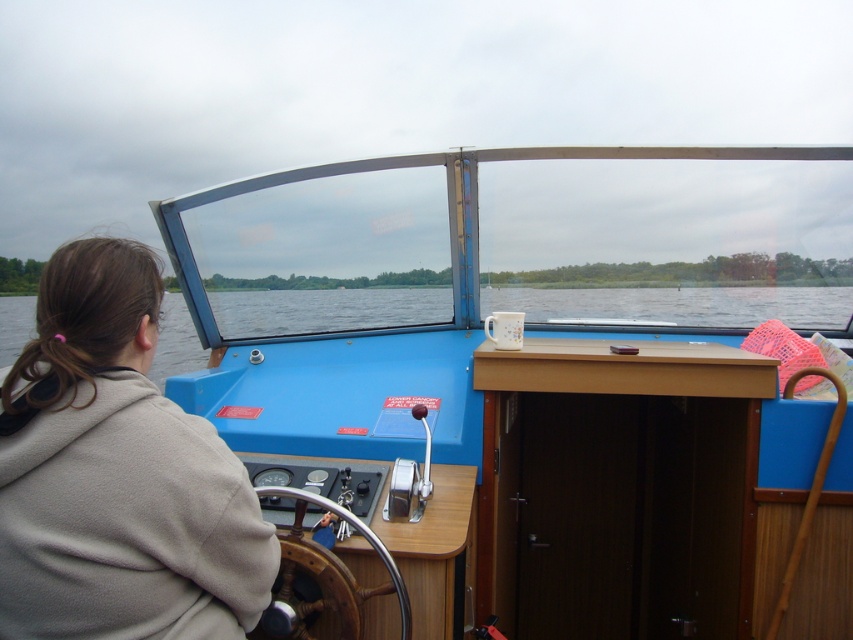
Question: Does beige fleece jacket at lower left come in front of transparent glass water at center?

Choices:
 (A) no
 (B) yes

Answer: (B)

Question: Is beige fleece jacket at lower left positioned in front of transparent glass water at center?

Choices:
 (A) yes
 (B) no

Answer: (A)

Question: Which of the following is the closest to the observer?

Choices:
 (A) transparent glass water at center
 (B) beige fleece jacket at lower left

Answer: (B)

Question: Is beige fleece jacket at lower left to the right of transparent glass water at center from the viewer's perspective?

Choices:
 (A) no
 (B) yes

Answer: (B)

Question: Which point is closer to the camera?

Choices:
 (A) (190, 324)
 (B) (55, 285)

Answer: (B)